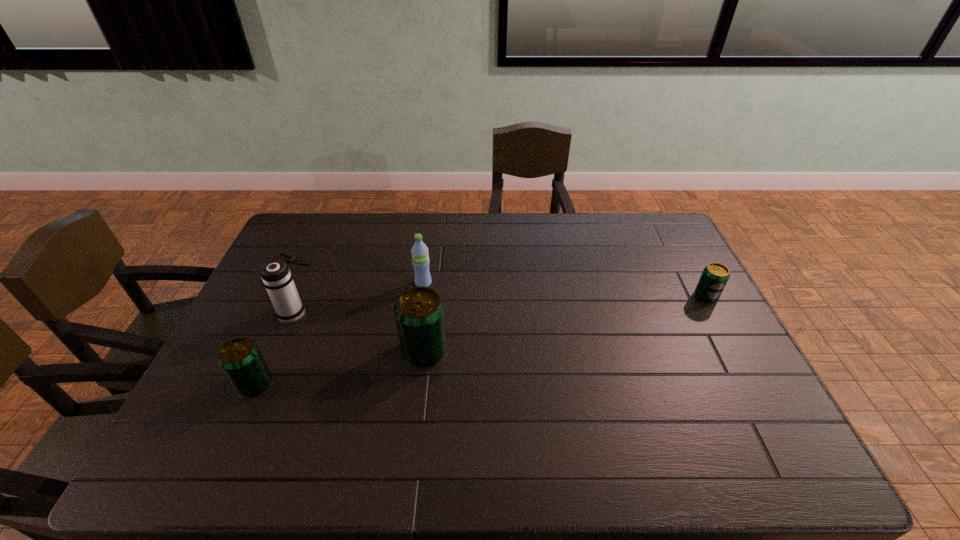
At what (x,y) coordinates should I click in order to perform the action: click on vacant position for inserting another beer_can evenly. Please return your answer as a coordinate pair (x, y). The width and height of the screenshot is (960, 540). Looking at the image, I should click on (574, 321).